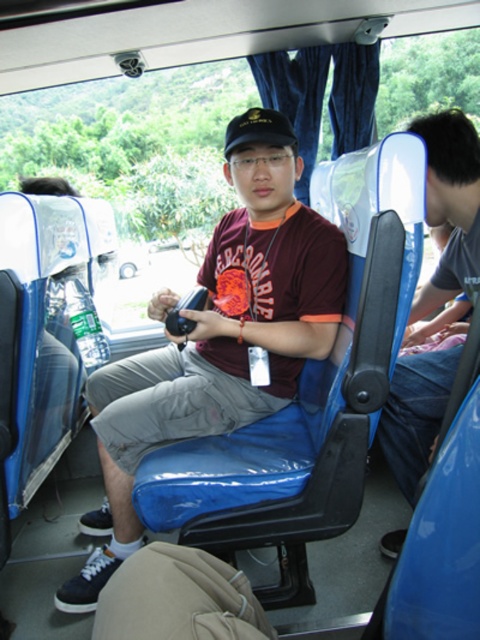
Question: Estimate the real-world distances between objects in this image. Which object is closer to the matte black shirt at center?

Choices:
 (A) black fabric baseball hat at center
 (B) matte blue shirt at center

Answer: (B)

Question: Is matte black shirt at center further to the viewer compared to matte blue shirt at center?

Choices:
 (A) no
 (B) yes

Answer: (B)

Question: Which point is farther from the camera taking this photo?

Choices:
 (A) coord(240,122)
 (B) coord(441,204)

Answer: (B)

Question: Where is matte black shirt at center located in relation to black fabric baseball hat at center in the image?

Choices:
 (A) below
 (B) above

Answer: (A)

Question: Is matte black shirt at center thinner than black fabric baseball hat at center?

Choices:
 (A) no
 (B) yes

Answer: (A)

Question: Which of the following is the farthest from the observer?

Choices:
 (A) matte black shirt at center
 (B) black fabric baseball hat at center

Answer: (B)